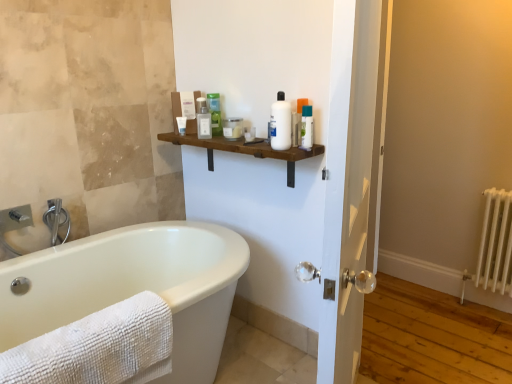
Describe the element at coordinates (98, 347) in the screenshot. I see `white textured towel at lower left` at that location.

Measure the distance between point (181, 125) and camera.

7.06 feet.

Looking at this image, measure the distance between translucent plastic bottle at upper center, acting as the 2th toiletry starting from the left, and camera.

The distance of translucent plastic bottle at upper center, acting as the 2th toiletry starting from the left, from camera is 6.73 feet.

What do you see at coordinates (204, 123) in the screenshot?
I see `translucent plastic bottle at upper center, acting as the 2th toiletry starting from the left` at bounding box center [204, 123].

What do you see at coordinates (280, 123) in the screenshot? I see `white glossy bottle at center, placed as the second toiletry when sorted from right to left` at bounding box center [280, 123].

What is the approximate height of translucent plastic tube at upper center, which is the 6th toiletry from left to right?

It is 7.01 inches.

Image resolution: width=512 pixels, height=384 pixels. I want to click on white metallic radiator at right, so click(x=496, y=243).

Locate an element on the screen. This screenshot has width=512, height=384. brushed metal faucet at left is located at coordinates (56, 220).

Find the location of a particular element. This screenshot has width=512, height=384. brushed metal faucet at left is located at coordinates (14, 224).

This screenshot has height=384, width=512. I want to click on white textured towel at lower left, so click(x=98, y=347).

Based on the photo, could you tell me if white matte tube at upper center, which is the 1th toiletry in left-to-right order, is facing brushed metal faucet at left?

No, white matte tube at upper center, which is the 1th toiletry in left-to-right order, is not turned towards brushed metal faucet at left.

Is white matte tube at upper center, which is the 1th toiletry in left-to-right order, not within brushed metal faucet at left?

white matte tube at upper center, which is the 1th toiletry in left-to-right order, is positioned outside brushed metal faucet at left.

Locate an element on the screen. the 1st toiletry to the right when counting from the brushed metal faucet at left is located at coordinates (181, 125).

From the image's perspective, relative to brushed metal faucet at left, is white matte tube at upper center, the sixth toiletry from the right, above or below?

white matte tube at upper center, the sixth toiletry from the right, is situated higher than brushed metal faucet at left in the image.

How many degrees apart are the facing directions of brushed metal faucet at left and white glossy bottle at center, which is counted as the fifth toiletry, starting from the left?

The facing directions of brushed metal faucet at left and white glossy bottle at center, which is counted as the fifth toiletry, starting from the left, are 88.6 degrees apart.

Identify the location of the 6th toiletry above the brushed metal faucet at left (from a real-world perspective). (280, 123).

From the picture: Which is closer to the camera, (x=3, y=248) or (x=284, y=142)?

Positioned in front is point (x=284, y=142).

Can you confirm if brushed metal faucet at left is taller than white glossy bottle at center, which is counted as the fifth toiletry, starting from the left?

No.

From a real-world perspective, is translucent plastic jar at upper center, placed as the fourth toiletry when sorted from left to right, physically located above or below white metallic radiator at right?

In terms of real-world spatial position, translucent plastic jar at upper center, placed as the fourth toiletry when sorted from left to right, is above white metallic radiator at right.

Is translucent plastic jar at upper center, placed as the fourth toiletry when sorted from left to right, inside the boundaries of white metallic radiator at right, or outside?

translucent plastic jar at upper center, placed as the fourth toiletry when sorted from left to right, lies outside white metallic radiator at right.

Which is in front, point (234, 119) or point (498, 212)?

The point (234, 119) is closer.

Find the location of `radiator below the translucent plastic jar at upper center, placed as the fourth toiletry when sorted from left to right (from a real-world perspective)`. radiator below the translucent plastic jar at upper center, placed as the fourth toiletry when sorted from left to right (from a real-world perspective) is located at coordinates (496, 243).

Can you confirm if translucent plastic bottle at upper center, which is the 5th toiletry in right-to-left order, is bigger than white glossy bottle at center, placed as the second toiletry when sorted from right to left?

Incorrect, translucent plastic bottle at upper center, which is the 5th toiletry in right-to-left order, is not larger than white glossy bottle at center, placed as the second toiletry when sorted from right to left.

Considering the relative positions of translucent plastic bottle at upper center, acting as the 2th toiletry starting from the left, and white glossy bottle at center, which is counted as the fifth toiletry, starting from the left, in the image provided, is translucent plastic bottle at upper center, acting as the 2th toiletry starting from the left, to the right of white glossy bottle at center, which is counted as the fifth toiletry, starting from the left, from the viewer's perspective?

In fact, translucent plastic bottle at upper center, acting as the 2th toiletry starting from the left, is to the left of white glossy bottle at center, which is counted as the fifth toiletry, starting from the left.

The height and width of the screenshot is (384, 512). I want to click on towel that is under the brushed metal faucet at left (from a real-world perspective), so click(98, 347).

Is brushed metal faucet at left oriented away from white textured towel at lower left?

brushed metal faucet at left does not have its back to white textured towel at lower left.

Are brushed metal faucet at left and white textured towel at lower left beside each other?

brushed metal faucet at left is not next to white textured towel at lower left, and they're not touching.

From a real-world perspective, is translucent plastic jar at upper center, acting as the third toiletry starting from the right, located higher than brushed metal faucet at left?

Indeed, from a real-world perspective, translucent plastic jar at upper center, acting as the third toiletry starting from the right, stands above brushed metal faucet at left.

From their relative heights in the image, would you say translucent plastic jar at upper center, placed as the fourth toiletry when sorted from left to right, is taller or shorter than brushed metal faucet at left?

Clearly, translucent plastic jar at upper center, placed as the fourth toiletry when sorted from left to right, is shorter compared to brushed metal faucet at left.

Looking at this image, from a real-world perspective, is green matte bottle at upper center, the fourth toiletry in the right-to-left sequence, on top of white glossy bottle at center, which is counted as the fifth toiletry, starting from the left?

Actually, green matte bottle at upper center, the fourth toiletry in the right-to-left sequence, is physically below white glossy bottle at center, which is counted as the fifth toiletry, starting from the left, in the real world.

From the image's perspective, between green matte bottle at upper center, the fourth toiletry in the right-to-left sequence, and white glossy bottle at center, placed as the second toiletry when sorted from right to left, which one is located above?

green matte bottle at upper center, the fourth toiletry in the right-to-left sequence, appears higher in the image.

Is green matte bottle at upper center, the fourth toiletry in the right-to-left sequence, positioned with its back to white glossy bottle at center, which is counted as the fifth toiletry, starting from the left?

No, green matte bottle at upper center, the fourth toiletry in the right-to-left sequence, is not facing the opposite direction of white glossy bottle at center, which is counted as the fifth toiletry, starting from the left.

Where is `the 1st toiletry counting from the right of the brushed metal faucet at left`? Image resolution: width=512 pixels, height=384 pixels. the 1st toiletry counting from the right of the brushed metal faucet at left is located at coordinates (181, 125).

This screenshot has height=384, width=512. What are the coordinates of `sink below the white glossy bottle at center, placed as the second toiletry when sorted from right to left (from a real-world perspective)` in the screenshot? It's located at (14, 224).

Consider the image. Based on their spatial positions, is translucent plastic bottle at upper center, which is the 5th toiletry in right-to-left order, or translucent plastic tube at upper center, which appears as the 1th toiletry when viewed from the right, further from white glossy bottle at center, placed as the second toiletry when sorted from right to left?

The object further to white glossy bottle at center, placed as the second toiletry when sorted from right to left, is translucent plastic bottle at upper center, which is the 5th toiletry in right-to-left order.

When comparing their distances from brushed metal faucet at left, does white matte tube at upper center, the sixth toiletry from the right, or white metallic radiator at right seem closer?

white matte tube at upper center, the sixth toiletry from the right, is closer to brushed metal faucet at left.

Estimate the real-world distances between objects in this image. Which object is closer to white metallic radiator at right, wooden shelf at center or translucent plastic jar at upper center, acting as the third toiletry starting from the right?

wooden shelf at center is positioned closer to the anchor white metallic radiator at right.

Considering their positions, is brushed metal faucet at left positioned closer to white textured towel at lower left than translucent plastic bottle at upper center, acting as the 2th toiletry starting from the left?

brushed metal faucet at left is closer to white textured towel at lower left.

Which object lies further to the anchor point white metallic radiator at right, white textured towel at lower left or white matte tube at upper center, the sixth toiletry from the right?

white textured towel at lower left lies further to white metallic radiator at right than the other object.

When comparing their distances from translucent plastic jar at upper center, placed as the fourth toiletry when sorted from left to right, does wooden shelf at center or green matte bottle at upper center, which is the third toiletry from left to right, seem closer?

green matte bottle at upper center, which is the third toiletry from left to right.

From the picture: Considering their positions, is white matte tube at upper center, the sixth toiletry from the right, positioned further to brushed metal faucet at left than white metallic radiator at right?

white metallic radiator at right.

Looking at the image, which one is located further to wooden shelf at center, white metallic radiator at right or white textured towel at lower left?

white metallic radiator at right is positioned further to the anchor wooden shelf at center.

This screenshot has width=512, height=384. I want to click on shelf between translucent plastic tube at upper center, which is the 6th toiletry from left to right, and white textured towel at lower left from top to bottom, so click(x=245, y=150).

In order to click on towel between brushed metal faucet at left and white glossy bottle at center, placed as the second toiletry when sorted from right to left, in the horizontal direction in this screenshot , I will do `click(98, 347)`.

You are a GUI agent. You are given a task and a screenshot of the screen. Output one action in this format:
    pyautogui.click(x=<x>, y=<y>)
    Task: Click on the shelf positioned between white textured towel at lower left and green matte bottle at upper center, the fourth toiletry in the right-to-left sequence, from near to far
    
    Given the screenshot: What is the action you would take?
    pyautogui.click(x=245, y=150)

At what (x,y) coordinates should I click in order to perform the action: click on shelf between brushed metal faucet at left and white metallic radiator at right from left to right. Please return your answer as a coordinate pair (x, y). The width and height of the screenshot is (512, 384). Looking at the image, I should click on (245, 150).